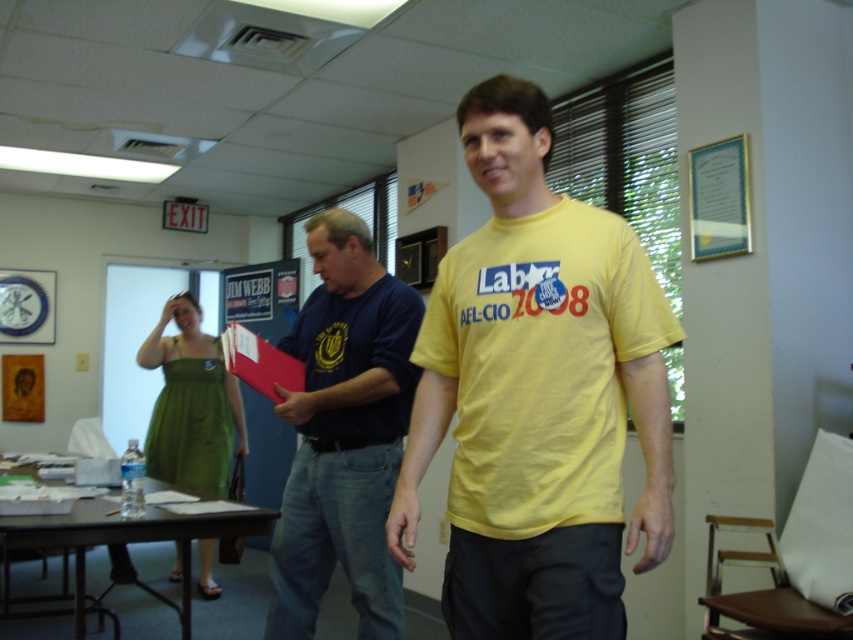
In the scene shown: Does yellow cotton t-shirt at center have a smaller size compared to dark blue t-shirt at center?

Actually, yellow cotton t-shirt at center might be larger than dark blue t-shirt at center.

Who is higher up, yellow cotton t-shirt at center or dark blue t-shirt at center?

yellow cotton t-shirt at center

This screenshot has width=853, height=640. What are the coordinates of `yellow cotton t-shirt at center` in the screenshot? It's located at (537, 394).

You are a GUI agent. You are given a task and a screenshot of the screen. Output one action in this format:
    pyautogui.click(x=<x>, y=<y>)
    Task: Click on the yellow cotton t-shirt at center
    The image size is (853, 640).
    Given the screenshot: What is the action you would take?
    pyautogui.click(x=537, y=394)